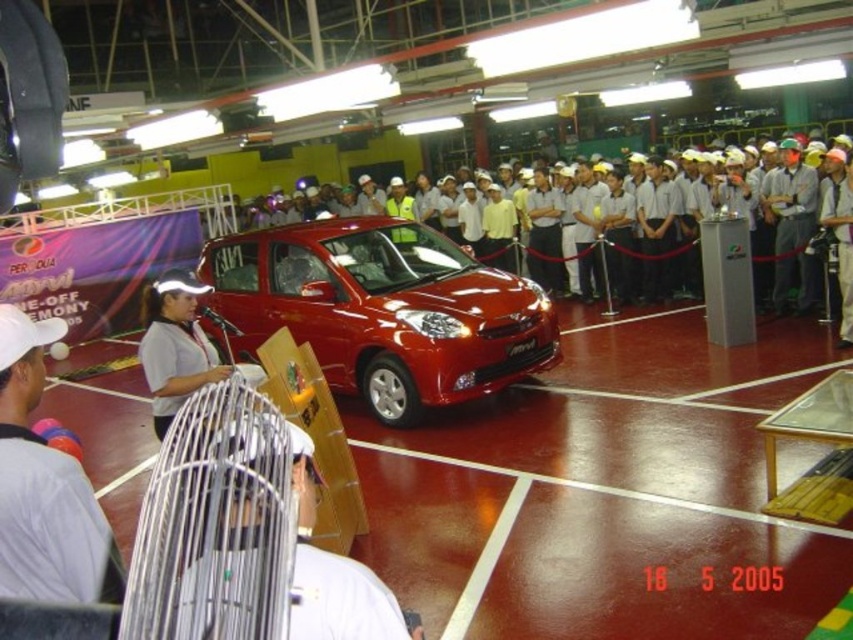
Question: Does white fabric fan at center have a greater width compared to white fabric shirt at center?

Choices:
 (A) yes
 (B) no

Answer: (B)

Question: Is white fabric fan at center positioned in front of white hard hats at center?

Choices:
 (A) no
 (B) yes

Answer: (B)

Question: Is glossy red car at center wider than white fabric cap at center?

Choices:
 (A) no
 (B) yes

Answer: (B)

Question: Which object is closer to the camera taking this photo?

Choices:
 (A) white fabric cap at center
 (B) glossy red car at center
 (C) white fabric fan at center
 (D) white hard hats at center

Answer: (C)

Question: Which of the following is the closest to the observer?

Choices:
 (A) white fabric shirt at center
 (B) white hard hats at center

Answer: (A)

Question: Which of these objects is positioned farthest from the white fabric cap at center?

Choices:
 (A) white fabric shirt at center
 (B) white hard hats at center
 (C) white fabric fan at center

Answer: (B)